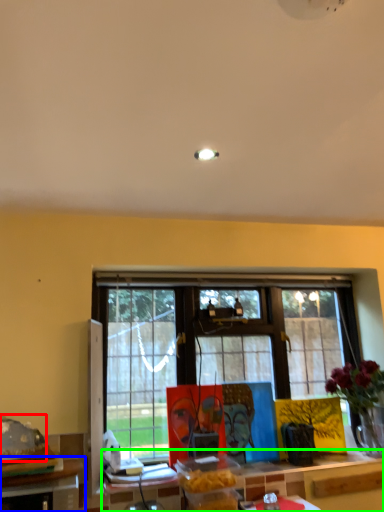
Question: Considering the real-world distances, which object is closest to food (highlighted by a red box)? table (highlighted by a blue box) or table (highlighted by a green box).

Choices:
 (A) table
 (B) table

Answer: (A)